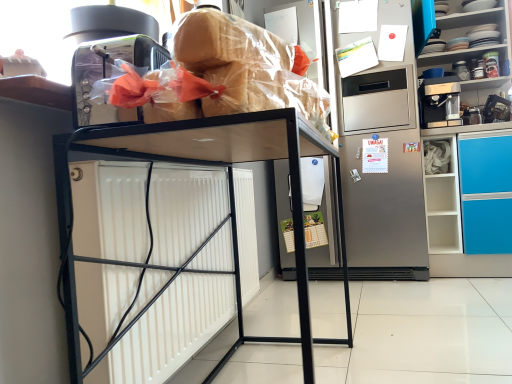
Question: Does stainless steel refrigerator at center have a lesser height compared to porcelain plates at upper right?

Choices:
 (A) yes
 (B) no

Answer: (B)

Question: Does stainless steel refrigerator at center have a larger size compared to porcelain plates at upper right?

Choices:
 (A) no
 (B) yes

Answer: (B)

Question: From the image's perspective, would you say stainless steel refrigerator at center is positioned over porcelain plates at upper right?

Choices:
 (A) yes
 (B) no

Answer: (B)

Question: Does stainless steel refrigerator at center have a lesser width compared to porcelain plates at upper right?

Choices:
 (A) no
 (B) yes

Answer: (B)

Question: Is stainless steel refrigerator at center positioned far away from porcelain plates at upper right?

Choices:
 (A) yes
 (B) no

Answer: (B)

Question: Does stainless steel refrigerator at center lie behind porcelain plates at upper right?

Choices:
 (A) no
 (B) yes

Answer: (B)

Question: From the image's perspective, is translucent plastic bread at upper center below bread at upper center?

Choices:
 (A) yes
 (B) no

Answer: (B)

Question: Considering the relative positions of translucent plastic bread at upper center and bread at upper center in the image provided, is translucent plastic bread at upper center in front of bread at upper center?

Choices:
 (A) yes
 (B) no

Answer: (B)

Question: Can you confirm if translucent plastic bread at upper center is shorter than bread at upper center?

Choices:
 (A) no
 (B) yes

Answer: (A)

Question: From a real-world perspective, is translucent plastic bread at upper center below bread at upper center?

Choices:
 (A) yes
 (B) no

Answer: (B)

Question: Can you confirm if translucent plastic bread at upper center is positioned to the right of bread at upper center?

Choices:
 (A) no
 (B) yes

Answer: (A)

Question: Could bread at upper center be considered to be inside translucent plastic bread at upper center?

Choices:
 (A) yes
 (B) no

Answer: (A)

Question: Is translucent plastic bread at upper center facing away from stainless steel refrigerator at center?

Choices:
 (A) no
 (B) yes

Answer: (A)